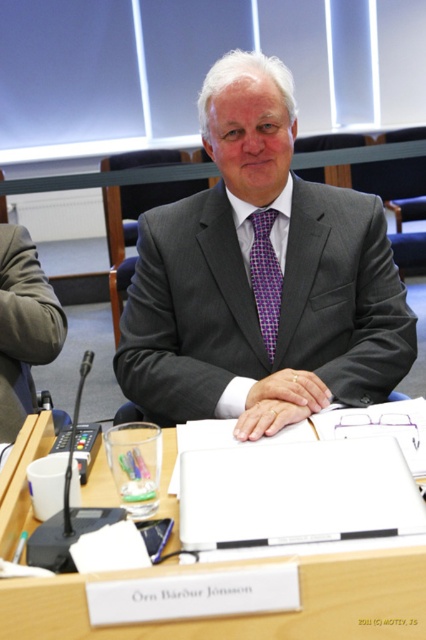
What do you see at coordinates (261, 278) in the screenshot? Image resolution: width=426 pixels, height=640 pixels. I see `gray textured suit at center` at bounding box center [261, 278].

Is point (215, 317) positioned behind point (256, 260)?

No, (215, 317) is closer to viewer.

Between point (241, 376) and point (278, 300), which one is positioned behind?

The point (278, 300) is behind.

You are a GUI agent. You are given a task and a screenshot of the screen. Output one action in this format:
    pyautogui.click(x=<x>, y=<y>)
    Task: Click on the gray textured suit at center
    Image resolution: width=426 pixels, height=640 pixels.
    Given the screenshot: What is the action you would take?
    pyautogui.click(x=261, y=278)

Is wooden table at center to the left of purple checkered tie at center from the viewer's perspective?

Correct, you'll find wooden table at center to the left of purple checkered tie at center.

Is point (287, 557) behind point (255, 257)?

No, (287, 557) is in front of (255, 257).

The width and height of the screenshot is (426, 640). Identify the location of wooden table at center. (250, 612).

From the picture: Measure the distance from matte black suit at center to purple checkered tie at center.

matte black suit at center is 23.19 inches from purple checkered tie at center.

Looking at this image, can you confirm if matte black suit at center is positioned to the left of purple checkered tie at center?

Indeed, matte black suit at center is positioned on the left side of purple checkered tie at center.

Between point (2, 438) and point (271, 336), which one is positioned behind?

Point (271, 336)

This screenshot has width=426, height=640. I want to click on matte black suit at center, so click(x=23, y=328).